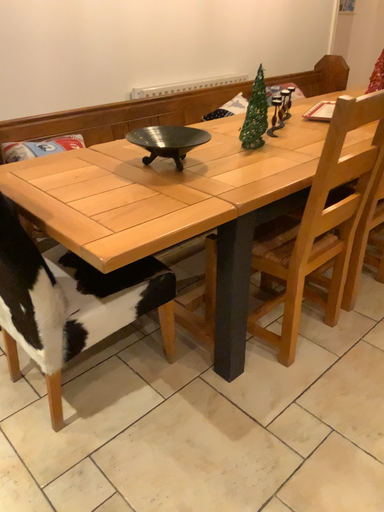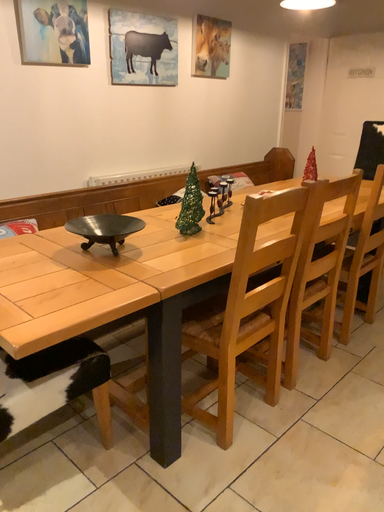
Question: Which way did the camera rotate in the video?

Choices:
 (A) rotated upward
 (B) rotated downward

Answer: (A)